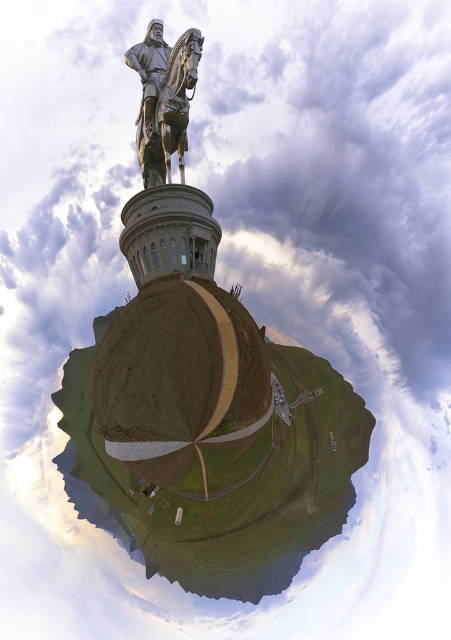
Does brown grassy hill at center have a lesser height compared to polished bronze statue at upper center?

In fact, brown grassy hill at center may be taller than polished bronze statue at upper center.

Can you confirm if brown grassy hill at center is thinner than polished bronze statue at upper center?

In fact, brown grassy hill at center might be wider than polished bronze statue at upper center.

What do you see at coordinates (211, 440) in the screenshot? The width and height of the screenshot is (451, 640). I see `brown grassy hill at center` at bounding box center [211, 440].

Locate an element on the screen. This screenshot has height=640, width=451. brown grassy hill at center is located at coordinates (211, 440).

Does bronze statue at upper center appear under polished bronze statue at upper center?

Indeed, bronze statue at upper center is positioned under polished bronze statue at upper center.

This screenshot has width=451, height=640. I want to click on bronze statue at upper center, so click(164, 99).

The height and width of the screenshot is (640, 451). What do you see at coordinates (164, 99) in the screenshot?
I see `bronze statue at upper center` at bounding box center [164, 99].

I want to click on bronze statue at upper center, so click(x=164, y=99).

Which is in front, point (128, 461) or point (141, 120)?

Point (128, 461) is more forward.

Does brown grassy hill at center have a greater height compared to bronze statue at upper center?

Indeed, brown grassy hill at center has a greater height compared to bronze statue at upper center.

The height and width of the screenshot is (640, 451). In order to click on brown grassy hill at center in this screenshot , I will do `click(211, 440)`.

Locate an element on the screen. Image resolution: width=451 pixels, height=640 pixels. brown grassy hill at center is located at coordinates (211, 440).